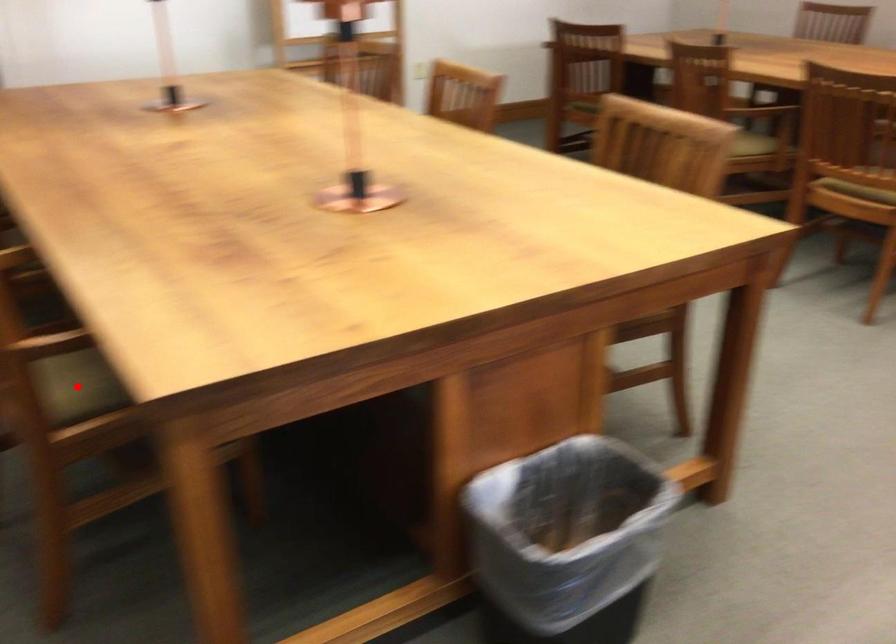
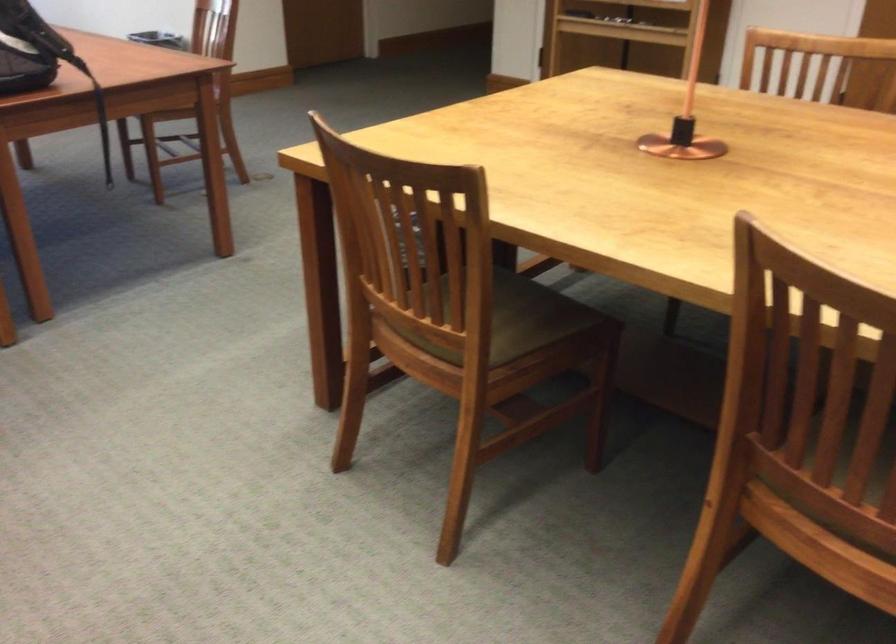
Question: I am providing you with two images of the same scene from different viewpoints. A red point is marked on the first image. Is the red point's position out of view in image 2?

Choices:
 (A) Yes
 (B) No

Answer: (A)